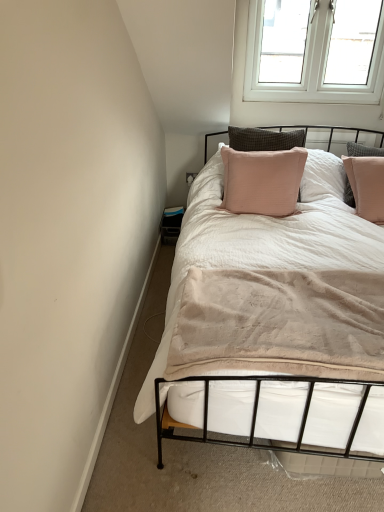
The image size is (384, 512). Identify the location of white plastic window at upper right. (310, 62).

Measure the distance between white plastic window at upper right and camera.

white plastic window at upper right and camera are 2.39 meters apart.

Where is `pink fabric pillow at upper center`? This screenshot has width=384, height=512. pink fabric pillow at upper center is located at coordinates (295, 127).

You are a GUI agent. You are given a task and a screenshot of the screen. Output one action in this format:
    pyautogui.click(x=<x>, y=<y>)
    Task: Click on the white plastic window at upper right
    The height and width of the screenshot is (512, 384).
    Given the screenshot: What is the action you would take?
    pyautogui.click(x=310, y=62)

From the image's perspective, does pink fabric pillow at upper center appear higher than white plastic window at upper right?

Incorrect, from the image's perspective, pink fabric pillow at upper center is lower than white plastic window at upper right.

In the image, is pink fabric pillow at upper center positioned in front of or behind white plastic window at upper right?

pink fabric pillow at upper center is positioned closer to the viewer than white plastic window at upper right.

Locate an element on the screen. headboard below the white plastic window at upper right (from a real-world perspective) is located at coordinates (295, 127).

Between white plastic window at upper right and pink fabric pillow at upper center, which one appears on the left side from the viewer's perspective?

From the viewer's perspective, pink fabric pillow at upper center appears more on the left side.

Between white plastic window at upper right and pink fabric pillow at upper center, which one has more height?

Standing taller between the two is pink fabric pillow at upper center.

From a real-world perspective, is white plastic window at upper right located beneath pink fabric pillow at upper center?

No, from a real-world perspective, white plastic window at upper right is not beneath pink fabric pillow at upper center.

Is white plastic window at upper right not within pink fabric pillow at upper center?

white plastic window at upper right lies outside pink fabric pillow at upper center's area.

From a real-world perspective, does white soft bed at center stand above pink fabric pillow at upper center?

No.

Does white soft bed at center have a lesser width compared to pink fabric pillow at upper center?

No.

Between white soft bed at center and pink fabric pillow at upper center, which one has larger size?

Bigger between the two is white soft bed at center.

Is point (256, 339) positioned in front of point (258, 127)?

Yes, point (256, 339) is in front of point (258, 127).

Is white plastic window at upper right aimed at white soft bed at center?

No, white plastic window at upper right does not turn towards white soft bed at center.

From the image's perspective, is white plastic window at upper right positioned above or below white soft bed at center?

From the image's perspective, white plastic window at upper right appears above white soft bed at center.

Between point (313, 33) and point (218, 275), which one is positioned behind?

The point (313, 33) is farther.

Are white plastic window at upper right and white soft bed at center located far from each other?

Absolutely, white plastic window at upper right is distant from white soft bed at center.

Is white soft bed at center positioned beyond the bounds of white plastic window at upper right?

white soft bed at center lies outside white plastic window at upper right's area.

Does point (198, 244) come in front of point (330, 38)?

That is True.

From the image's perspective, is white soft bed at center above white plastic window at upper right?

No, from the image's perspective, white soft bed at center is not above white plastic window at upper right.

Is the depth of white soft bed at center greater than that of white plastic window at upper right?

No, white soft bed at center is in front of white plastic window at upper right.

Considering the relative sizes of pink fabric pillow at upper center and white soft bed at center in the image provided, is pink fabric pillow at upper center bigger than white soft bed at center?

No.

From a real-world perspective, who is located lower, pink fabric pillow at upper center or white soft bed at center?

white soft bed at center.

Is point (205, 144) behind point (293, 250)?

Yes, it is behind point (293, 250).

Identify the location of bed that appears below the pink fabric pillow at upper center (from a real-world perspective). tap(270, 320).

Where is `window located above the pink fabric pillow at upper center (from the image's perspective)`? This screenshot has width=384, height=512. window located above the pink fabric pillow at upper center (from the image's perspective) is located at coordinates (310, 62).

The height and width of the screenshot is (512, 384). What are the coordinates of `window that is on the right side of pink fabric pillow at upper center` in the screenshot? It's located at (310, 62).

From the image, which object appears to be nearer to white plastic window at upper right, white soft bed at center or pink fabric pillow at upper center?

pink fabric pillow at upper center is closer to white plastic window at upper right.

Looking at the image, which one is located closer to white plastic window at upper right, pink fabric pillow at upper center or white soft bed at center?

The object closer to white plastic window at upper right is pink fabric pillow at upper center.

From the image, which object appears to be nearer to pink fabric pillow at upper center, white plastic window at upper right or white soft bed at center?

white plastic window at upper right is positioned closer to the anchor pink fabric pillow at upper center.

Considering their positions, is white plastic window at upper right positioned further to white soft bed at center than pink fabric pillow at upper center?

pink fabric pillow at upper center lies further to white soft bed at center than the other object.

Looking at the image, which one is located closer to pink fabric pillow at upper center, white soft bed at center or white plastic window at upper right?

white plastic window at upper right lies closer to pink fabric pillow at upper center than the other object.

From the image, which object appears to be farther from white soft bed at center, pink fabric pillow at upper center or white plastic window at upper right?

pink fabric pillow at upper center is further to white soft bed at center.

At what (x,y) coordinates should I click in order to perform the action: click on headboard between white plastic window at upper right and white soft bed at center in the up-down direction. Please return your answer as a coordinate pair (x, y). This screenshot has height=512, width=384. Looking at the image, I should click on (295, 127).